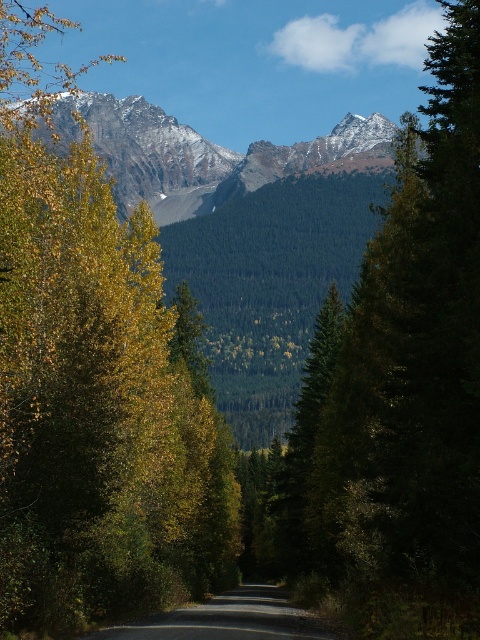
Between green matte tree at center and snowy rocky mountain range at upper center, which one is positioned higher?

snowy rocky mountain range at upper center

Does green matte tree at center appear over snowy rocky mountain range at upper center?

Incorrect, green matte tree at center is not positioned above snowy rocky mountain range at upper center.

Which is in front, point (468, 99) or point (343, 141)?

Point (468, 99)

This screenshot has width=480, height=640. Find the location of `green matte tree at center`. green matte tree at center is located at coordinates (399, 390).

Does green matte tree at center have a greater width compared to asphalt road at center?

Indeed, green matte tree at center has a greater width compared to asphalt road at center.

Who is more forward, (348,525) or (312,637)?

Point (312,637) is more forward.

You are a GUI agent. You are given a task and a screenshot of the screen. Output one action in this format:
    pyautogui.click(x=<x>, y=<y>)
    Task: Click on the green matte tree at center
    Image resolution: width=480 pixels, height=640 pixels.
    Given the screenshot: What is the action you would take?
    pyautogui.click(x=399, y=390)

Locate an element on the screen. This screenshot has height=640, width=480. green matte tree at center is located at coordinates (399, 390).

Is yellow-green foliage at left shorter than asphalt road at center?

In fact, yellow-green foliage at left may be taller than asphalt road at center.

Between point (24, 358) and point (220, 611), which one is positioned in front?

Positioned in front is point (24, 358).

This screenshot has width=480, height=640. Find the location of `yellow-green foliage at left`. yellow-green foliage at left is located at coordinates (96, 390).